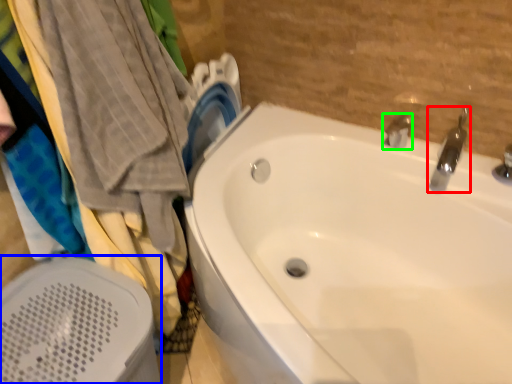
Question: Estimate the real-world distances between objects in this image. Which object is farther from tap (highlighted by a red box), bath heater (highlighted by a blue box) or tap (highlighted by a green box)?

Choices:
 (A) bath heater
 (B) tap

Answer: (A)